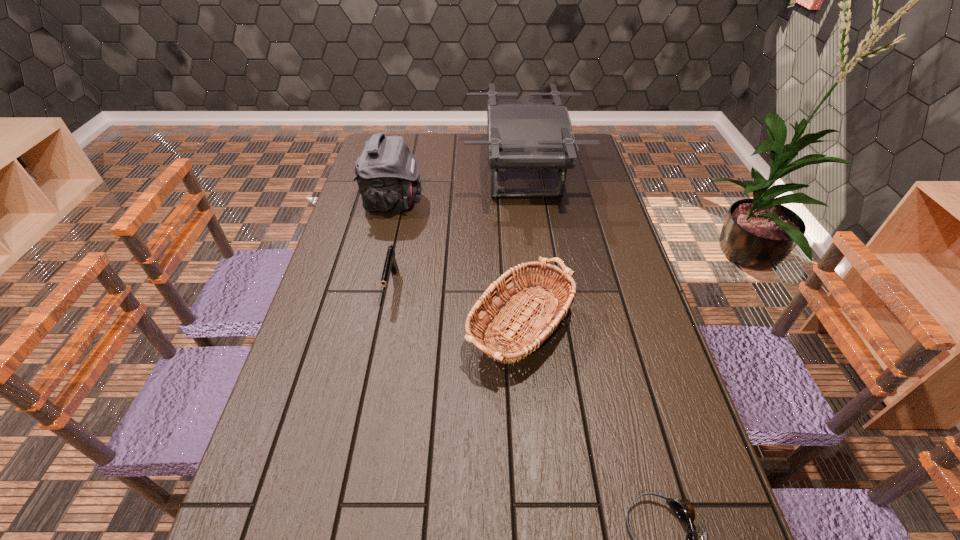
Find the location of `vacant point that satisfies the following two spatial constraints: 1. on the open flap of the third tallest object; 2. on the left side of the shoulder bag`. vacant point that satisfies the following two spatial constraints: 1. on the open flap of the third tallest object; 2. on the left side of the shoulder bag is located at coordinates (364, 326).